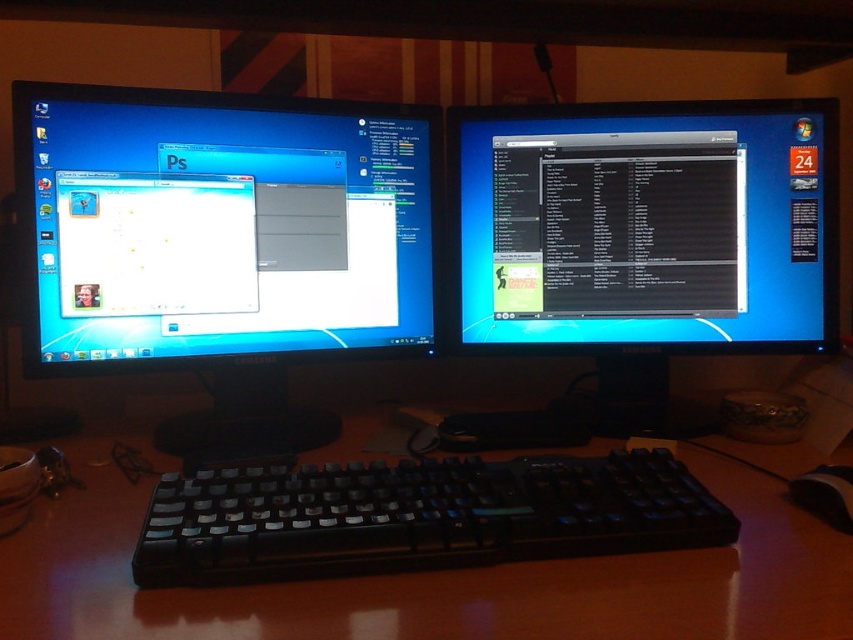
Who is shorter, matte black monitor at left or black matte text editor at center?

Standing shorter between the two is black matte text editor at center.

Can you confirm if matte black monitor at left is positioned to the right of black matte text editor at center?

In fact, matte black monitor at left is to the left of black matte text editor at center.

The image size is (853, 640). Find the location of `matte black monitor at left`. matte black monitor at left is located at coordinates (223, 243).

Who is higher up, matte black monitor at left or black plastic mouse at lower right?

matte black monitor at left is above.

Measure the distance from matte black monitor at left to black plastic mouse at lower right.

They are 24.25 inches apart.

Between point (335, 312) and point (836, 509), which one is positioned in front?

Point (836, 509) is in front.

You are a GUI agent. You are given a task and a screenshot of the screen. Output one action in this format:
    pyautogui.click(x=<x>, y=<y>)
    Task: Click on the matte black monitor at left
    
    Given the screenshot: What is the action you would take?
    pyautogui.click(x=223, y=243)

Is black plastic computer desk at center to the right of black plastic keyboard at center from the viewer's perspective?

Yes, black plastic computer desk at center is to the right of black plastic keyboard at center.

Is point (550, 157) positioned behind point (659, 492)?

Yes, point (550, 157) is behind point (659, 492).

Is point (834, 304) farther from viewer compared to point (300, 500)?

Yes.

Where is `black plastic computer desk at center`? black plastic computer desk at center is located at coordinates (643, 237).